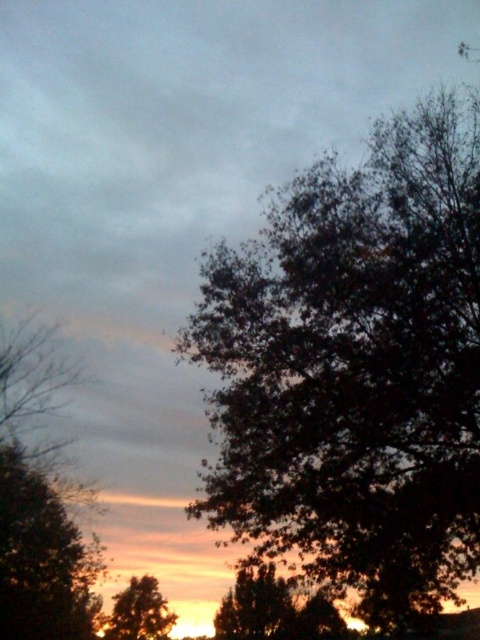
You are standing in the sunset scene and want to walk from the point closer to you to the point further away. Which path would you take between the two points, point (x=338, y=221) and point (x=147, y=600)?

The point closer to the viewer is point (x=338, y=221), so you would walk from point (x=338, y=221) to point (x=147, y=600) to reach the further point.

You are planning to hang a bird feeder between the dark green leafy tree at right and the brown textured tree at lower left. Based on their widths, which tree would require a longer rope to securely hang the feeder?

The dark green leafy tree at right might be wider than brown textured tree at lower left, so it would require a longer rope to securely hang the feeder.